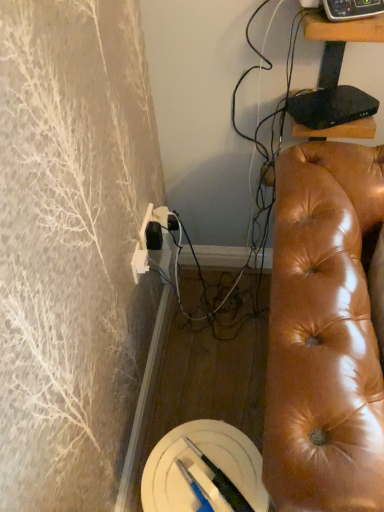
Question: Can you confirm if black glossy tv stand at upper right is bigger than black plastic remote control at upper right?

Choices:
 (A) no
 (B) yes

Answer: (B)

Question: Can you confirm if black glossy tv stand at upper right is taller than black plastic remote control at upper right?

Choices:
 (A) no
 (B) yes

Answer: (B)

Question: Can you see black glossy tv stand at upper right touching black plastic remote control at upper right?

Choices:
 (A) yes
 (B) no

Answer: (B)

Question: Could black plastic remote control at upper right be considered to be inside black glossy tv stand at upper right?

Choices:
 (A) yes
 (B) no

Answer: (B)

Question: From a real-world perspective, is black glossy tv stand at upper right positioned under black plastic remote control at upper right based on gravity?

Choices:
 (A) yes
 (B) no

Answer: (A)

Question: Is black glossy tv stand at upper right positioned beyond the bounds of black plastic remote control at upper right?

Choices:
 (A) yes
 (B) no

Answer: (A)

Question: Considering the relative sizes of black plastic remote control at upper right and shiny brown leather couch at right in the image provided, is black plastic remote control at upper right shorter than shiny brown leather couch at right?

Choices:
 (A) no
 (B) yes

Answer: (B)

Question: From the image's perspective, is black plastic remote control at upper right on top of shiny brown leather couch at right?

Choices:
 (A) no
 (B) yes

Answer: (B)

Question: Does black plastic remote control at upper right contain shiny brown leather couch at right?

Choices:
 (A) yes
 (B) no

Answer: (B)

Question: Can you confirm if black plastic remote control at upper right is smaller than shiny brown leather couch at right?

Choices:
 (A) yes
 (B) no

Answer: (A)

Question: Can you confirm if black plastic remote control at upper right is bigger than shiny brown leather couch at right?

Choices:
 (A) no
 (B) yes

Answer: (A)

Question: Can you confirm if black plastic remote control at upper right is positioned to the right of shiny brown leather couch at right?

Choices:
 (A) yes
 (B) no

Answer: (B)

Question: Would you say black glossy tv stand at upper right is part of shiny brown leather couch at right's contents?

Choices:
 (A) no
 (B) yes

Answer: (A)